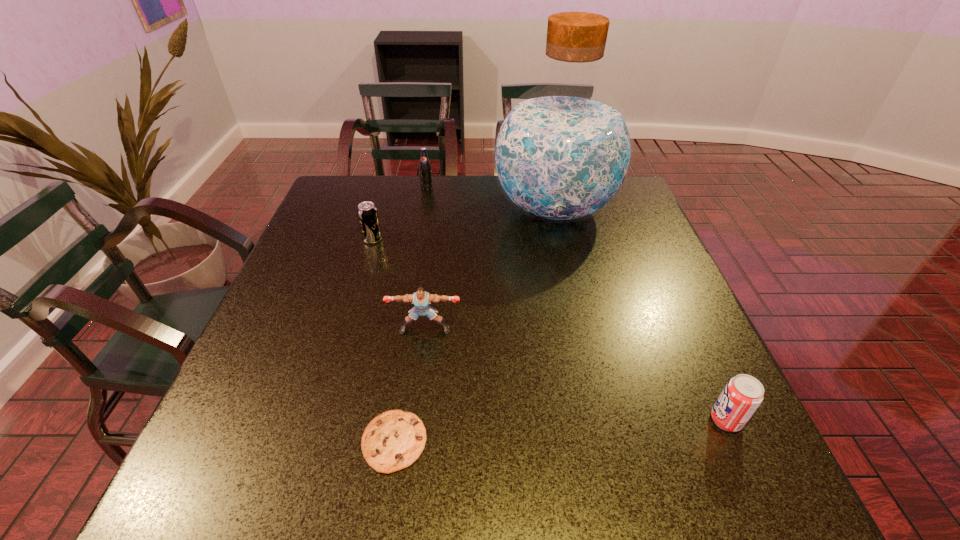
Locate an element on the screen. water jug located in the right edge section of the desktop is located at coordinates (562, 152).

This screenshot has width=960, height=540. Identify the location of soda can at the right edge. (742, 395).

Where is `object that is at the far right corner`? object that is at the far right corner is located at coordinates (562, 152).

You are a GUI agent. You are given a task and a screenshot of the screen. Output one action in this format:
    pyautogui.click(x=<x>, y=<y>)
    Task: Click on the free spot at the far edge of the desktop
    The image size is (960, 540).
    Given the screenshot: What is the action you would take?
    pyautogui.click(x=483, y=205)

Find the location of a particular element. free space at the near edge is located at coordinates coord(460,500).

Where is `vacant region at the left edge of the desktop`? vacant region at the left edge of the desktop is located at coordinates (315, 368).

You are a GUI agent. You are given a task and a screenshot of the screen. Output one action in this format:
    pyautogui.click(x=<x>, y=<y>)
    Task: Click on the free space at the right edge of the desktop
    The image size is (960, 540).
    Given the screenshot: What is the action you would take?
    pyautogui.click(x=705, y=422)

You are a GUI agent. You are given a task and a screenshot of the screen. Output one action in this format:
    pyautogui.click(x=<x>, y=<y>)
    Task: Click on the blank space at the far left corner
    The height and width of the screenshot is (540, 960).
    Given the screenshot: What is the action you would take?
    pyautogui.click(x=341, y=186)

Find the location of `unoccupied area between the nearest soda can and the third nearest object`. unoccupied area between the nearest soda can and the third nearest object is located at coordinates (575, 375).

Where is `vacant space that is in between the rightmost soda can and the leftmost soda can`? Image resolution: width=960 pixels, height=540 pixels. vacant space that is in between the rightmost soda can and the leftmost soda can is located at coordinates [x=549, y=330].